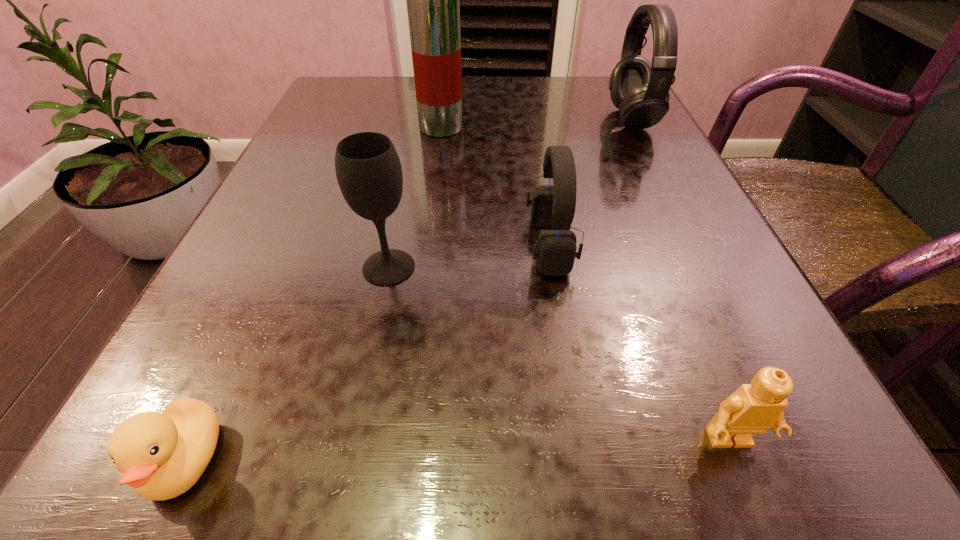
This screenshot has width=960, height=540. In order to click on duckling situated at the near edge in this screenshot , I will do `click(162, 455)`.

You are a GUI agent. You are given a task and a screenshot of the screen. Output one action in this format:
    pyautogui.click(x=<x>, y=<y>)
    Task: Click on the object at the left edge
    The height and width of the screenshot is (540, 960).
    Given the screenshot: What is the action you would take?
    [162, 455]

In order to click on headset that is at the right edge in this screenshot , I will do `click(640, 90)`.

The image size is (960, 540). I want to click on Lego located at the right edge, so tap(753, 408).

In order to click on object that is at the near left corner in this screenshot , I will do `click(162, 455)`.

Find the location of a particular element. object situated at the far right corner is located at coordinates (640, 90).

The width and height of the screenshot is (960, 540). Identify the location of object that is at the near right corner. (753, 408).

In the image, there is a desktop. What are the coordinates of `vacant space at the far edge` in the screenshot? It's located at (x=538, y=80).

The image size is (960, 540). In the image, there is a desktop. Find the location of `vacant space at the near edge`. vacant space at the near edge is located at coordinates (659, 487).

Image resolution: width=960 pixels, height=540 pixels. I want to click on vacant space at the left edge of the desktop, so click(x=290, y=182).